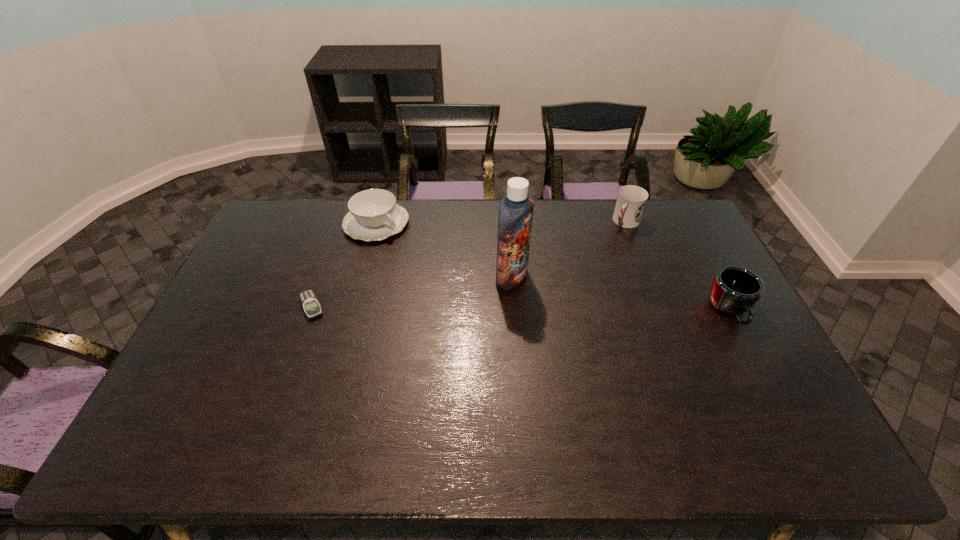
You are a GUI agent. You are given a task and a screenshot of the screen. Output one action in this format:
    pyautogui.click(x=<x>, y=<y>)
    Task: Click on the unoccupied area between the beeper and the fourth object from left to right
    
    Given the screenshot: What is the action you would take?
    pyautogui.click(x=468, y=264)

In order to click on vacant space that's between the chinaware and the beeper in this screenshot , I will do `click(344, 265)`.

Image resolution: width=960 pixels, height=540 pixels. I want to click on vacant space that's between the chinaware and the mug, so click(x=553, y=267).

This screenshot has height=540, width=960. Find the location of `free space between the chinaware and the shampoo`. free space between the chinaware and the shampoo is located at coordinates (444, 251).

Where is `object that is the nearest to the beeper`? object that is the nearest to the beeper is located at coordinates (374, 214).

Image resolution: width=960 pixels, height=540 pixels. Find the location of `the fourth closest object relative to the fourth object from left to right`. the fourth closest object relative to the fourth object from left to right is located at coordinates tap(311, 306).